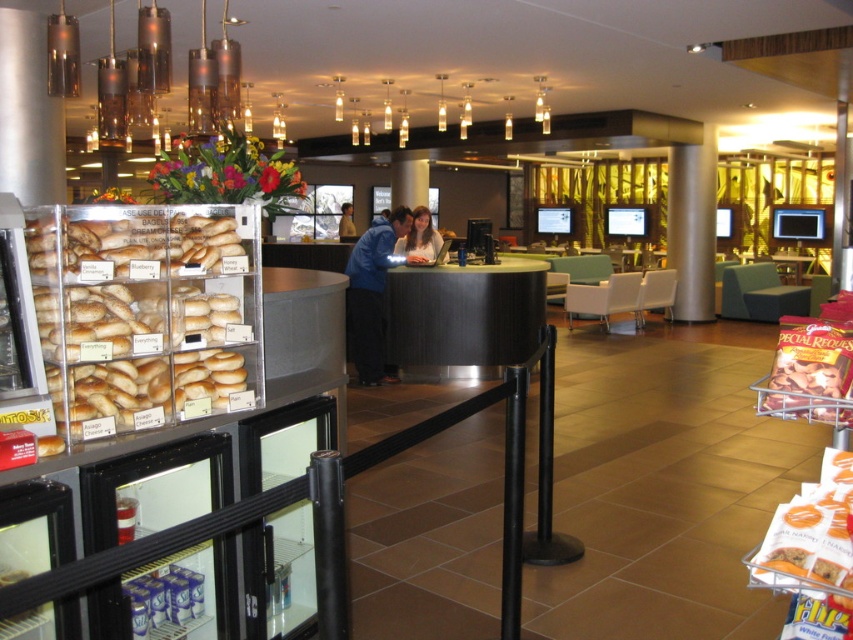
Who is more distant from viewer, (128, 371) or (352, 308)?

Positioned behind is point (352, 308).

Is golden brown bagels at left thinner than blue shirt at center?

Correct, golden brown bagels at left's width is less than blue shirt at center's.

Where is `golden brown bagels at left`? golden brown bagels at left is located at coordinates (146, 312).

Which is more to the right, matte blue shirt at center or blue fabric shirt at center?

Positioned to the right is matte blue shirt at center.

Between matte blue shirt at center and blue fabric shirt at center, which one is positioned lower?

matte blue shirt at center is below.

Who is more forward, (424, 237) or (349, 234)?

Point (424, 237)

Find the location of a particular element. The width and height of the screenshot is (853, 640). matte blue shirt at center is located at coordinates (421, 237).

Between silver metallic pillar at center and blue fabric shirt at center, which one has less height?

Standing shorter between the two is blue fabric shirt at center.

This screenshot has width=853, height=640. Identify the location of silver metallic pillar at center. (692, 227).

Locate an element on the screen. Image resolution: width=853 pixels, height=640 pixels. silver metallic pillar at center is located at coordinates (692, 227).